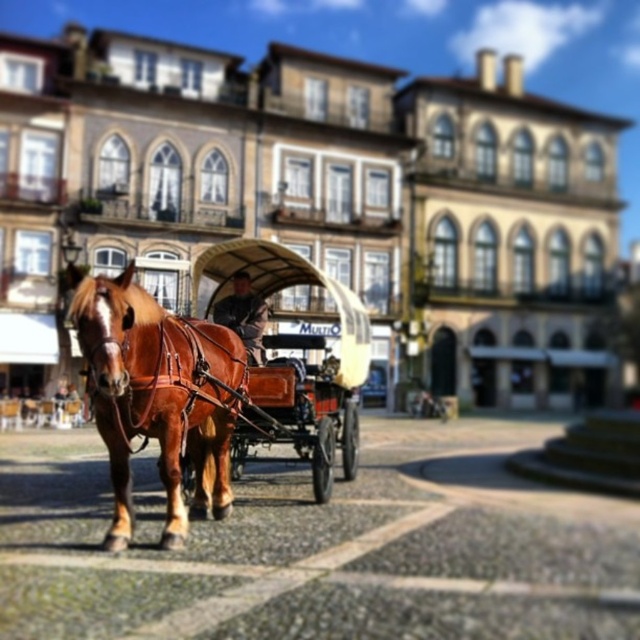
You are a delivery person with a cart that is 1.2 meters wide. You need to pass between the shiny brown leather horse cart at center and the wooden polished coach at center. Is there enough space for your cart to fit through the gap between them?

The gap between the shiny brown leather horse cart at center and the wooden polished coach at center is 1.08 meters. Since your cart is 1.2 meters wide, it is wider than the available space. Therefore, your cart cannot fit through the gap between them.

You are a tourist standing on the street and want to take a photo of the shiny brown horse at center and the shiny brown leather horse cart at center. To ensure both are in frame, should you position yourself to the left or right of the horse?

You should position yourself to the right of the shiny brown horse at center because the horse is to the left of the shiny brown leather horse cart at center, so placing yourself to the right of the horse will allow both objects to be captured in the frame.

You are a tour guide explaining the historical significance of the vehicles in the scene. Which of the two vehicles, the shiny brown leather horse cart at center or the wooden polished coach at center, is taller?

The shiny brown leather horse cart at center is taller than the wooden polished coach at center.